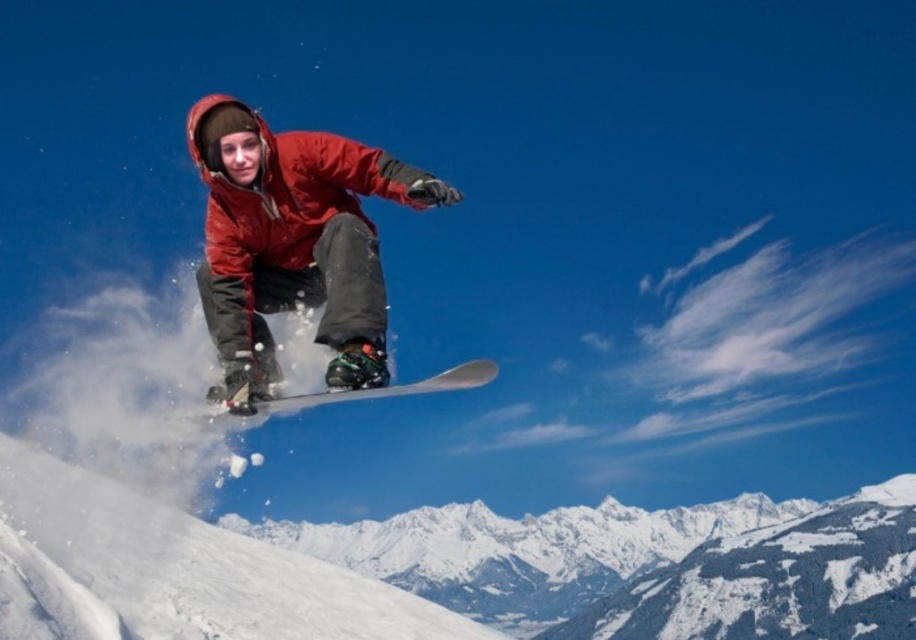
You are a photographer standing at the base of the mountain and want to capture the matte red snowboarder at center in your shot. Given that the snowboarder is 77.35 meters away from you, do you think you can fit them into your camera frame without zooming in?

The matte red snowboarder at center is 77.35 meters away from the viewer. Depending on the camera lens and field of view, it might be possible to capture them without zooming in, but the snowboarder would appear small in the frame.

You are a photographer trying to capture the snowboarder at point (x=465, y=364). If your camera has a focal length of 50mm and you want to focus on the snowboarder, what is the approximate distance in feet between the camera and the snowboarder?

The distance of point (x=465, y=364) from camera is 277.60 feet, so the camera is approximately 277.60 feet away from the snowboarder.

You are a photographer trying to capture the perfect shot of the matte red snowboarder at center. The camera you are using has a fixed focal point at coordinates point 0.3, 0.3. Will the snowboarder be in focus?

The matte red snowboarder at center is located at point (300, 253), which is very close to the camera focal point at (274, 192). The snowboarder will likely be in focus.